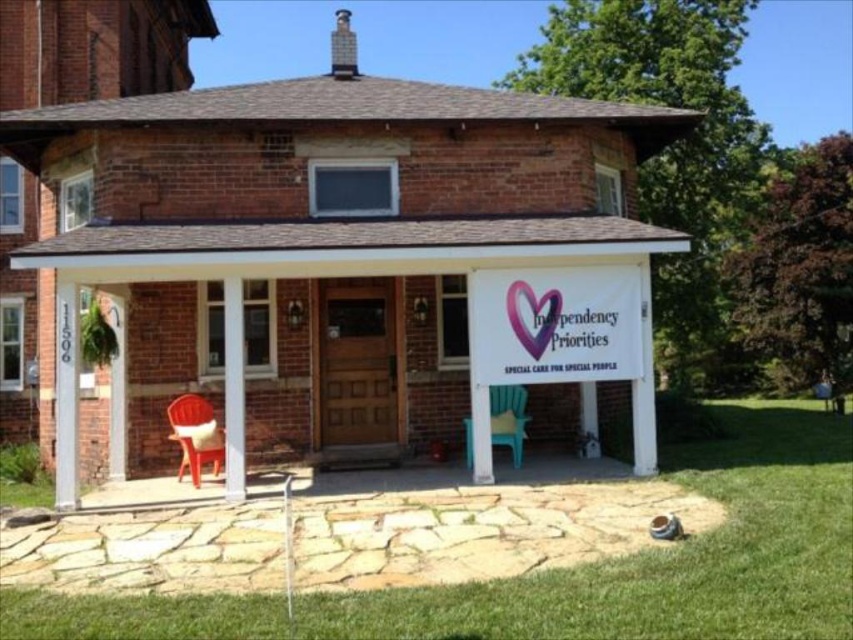
Question: Is white painted wood post at left to the right of plastic red chair at lower left from the viewer's perspective?

Choices:
 (A) no
 (B) yes

Answer: (A)

Question: Which point appears farthest from the camera in this image?

Choices:
 (A) (122, 392)
 (B) (242, 486)

Answer: (A)

Question: Estimate the real-world distances between objects in this image. Which object is farther from the white painted wood post at left?

Choices:
 (A) teal plastic chair at center
 (B) green grass at lower center

Answer: (B)

Question: Is green grass at lower center below teal plastic chair at center?

Choices:
 (A) no
 (B) yes

Answer: (B)

Question: Which point is farther from the camera taking this photo?

Choices:
 (A) (467, 445)
 (B) (241, 435)
 (C) (698, 472)

Answer: (A)

Question: Is white painted wood post at left above teal plastic chair at center?

Choices:
 (A) no
 (B) yes

Answer: (B)